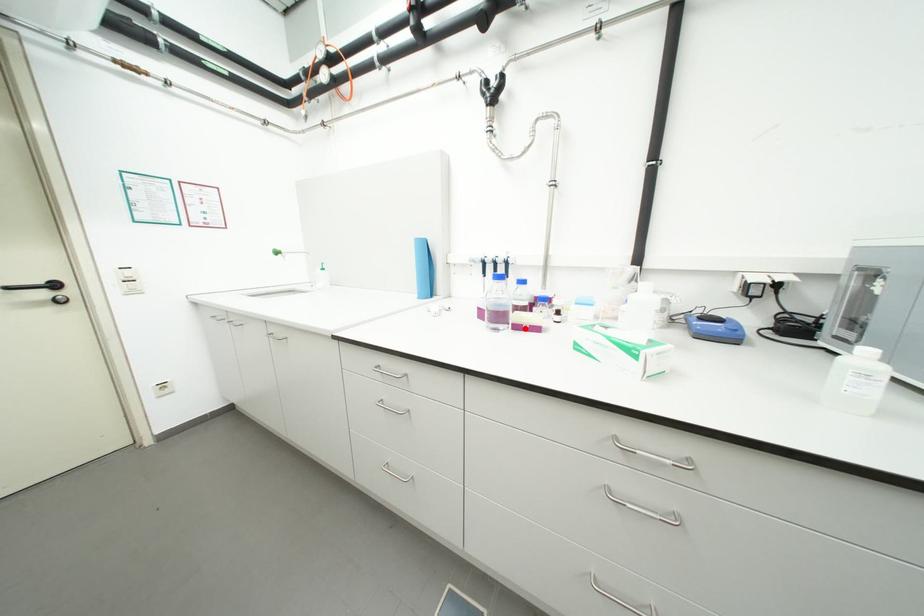
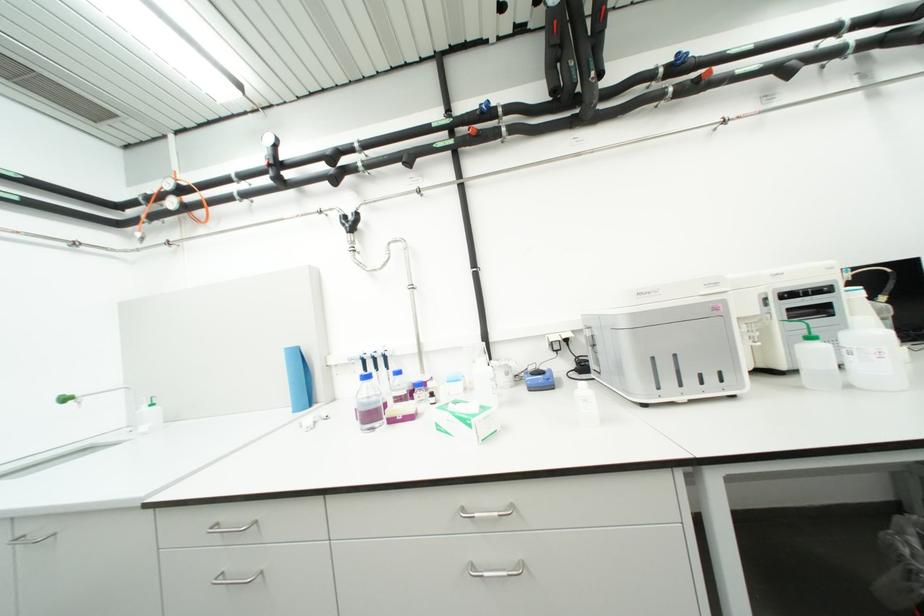
Where in the second image is the point corresponding to the highlighted location from the first image?

(399, 422)